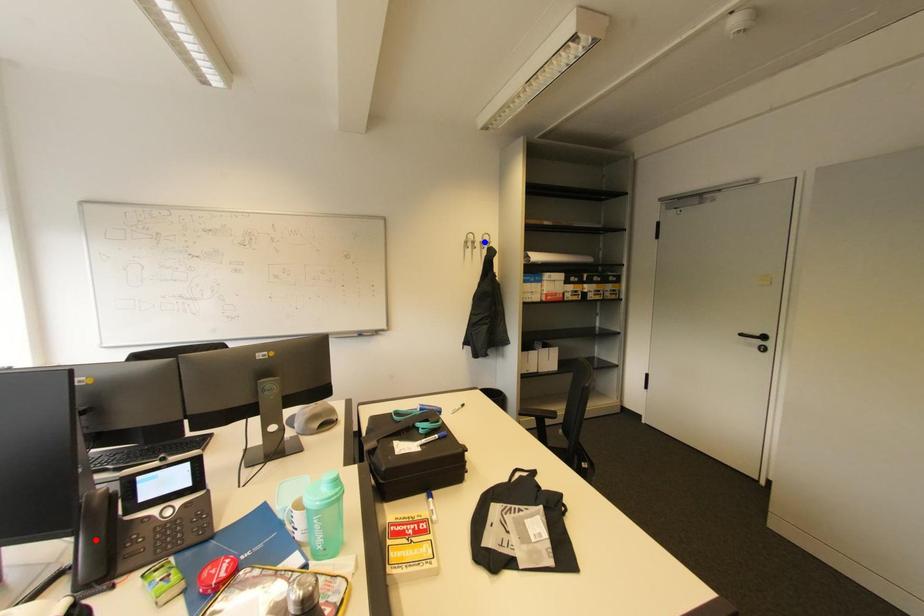
Question: Which of the two points in the image is closer to the camera?

Choices:
 (A) Blue point is closer.
 (B) Red point is closer.

Answer: (B)